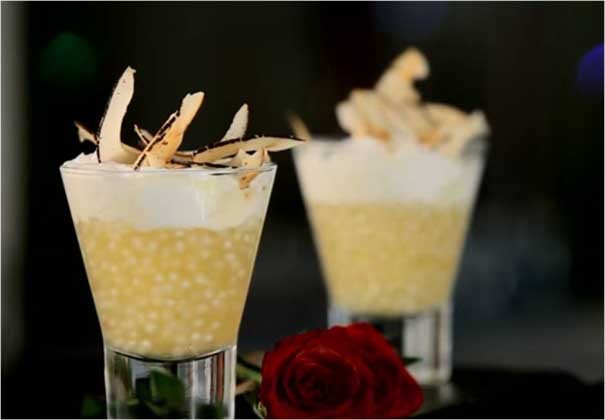
Image resolution: width=605 pixels, height=420 pixels. In order to click on dessert glass on right in this screenshot , I will do `click(394, 252)`.